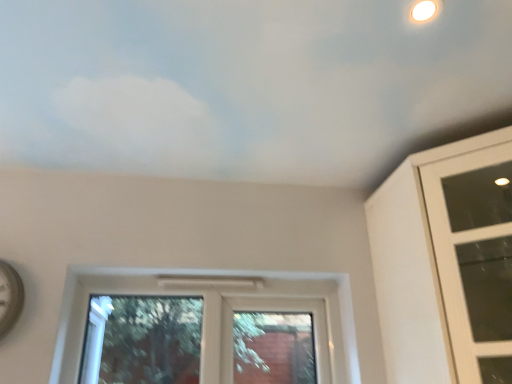
Question: From the image's perspective, is clear glass window at center, the 1th window viewed from the left, above white matte cloud at upper center?

Choices:
 (A) no
 (B) yes

Answer: (A)

Question: From the image's perspective, does clear glass window at center, marked as the 2th window in a right-to-left arrangement, appear lower than white matte cloud at upper center?

Choices:
 (A) yes
 (B) no

Answer: (A)

Question: Does clear glass window at center, marked as the 2th window in a right-to-left arrangement, appear on the right side of white matte cloud at upper center?

Choices:
 (A) no
 (B) yes

Answer: (A)

Question: Does clear glass window at center, marked as the 2th window in a right-to-left arrangement, have a smaller size compared to white matte cloud at upper center?

Choices:
 (A) yes
 (B) no

Answer: (A)

Question: Can we say clear glass window at center, the 1th window viewed from the left, lies outside white matte cloud at upper center?

Choices:
 (A) no
 (B) yes

Answer: (B)

Question: Considering the relative positions of clear glass window at center, the 1th window viewed from the left, and white matte cloud at upper center in the image provided, is clear glass window at center, the 1th window viewed from the left, to the left of white matte cloud at upper center from the viewer's perspective?

Choices:
 (A) yes
 (B) no

Answer: (A)

Question: Is white glass window at upper right, acting as the second window starting from the left, surrounding white matte cloud at upper center?

Choices:
 (A) no
 (B) yes

Answer: (A)

Question: Does white glass window at upper right, acting as the second window starting from the left, come behind white matte cloud at upper center?

Choices:
 (A) no
 (B) yes

Answer: (B)

Question: Can you confirm if white glass window at upper right, arranged as the first window when viewed from the right, is smaller than white matte cloud at upper center?

Choices:
 (A) no
 (B) yes

Answer: (A)

Question: Is white glass window at upper right, arranged as the first window when viewed from the right, not near white matte cloud at upper center?

Choices:
 (A) no
 (B) yes

Answer: (A)

Question: Does white glass window at upper right, arranged as the first window when viewed from the right, have a larger size compared to white matte cloud at upper center?

Choices:
 (A) yes
 (B) no

Answer: (A)

Question: Considering the relative positions of white glass window at upper right, arranged as the first window when viewed from the right, and white matte cloud at upper center in the image provided, is white glass window at upper right, arranged as the first window when viewed from the right, to the left of white matte cloud at upper center from the viewer's perspective?

Choices:
 (A) no
 (B) yes

Answer: (A)

Question: Is clear glass window at center, marked as the 2th window in a right-to-left arrangement, in contact with white glass window at upper right, arranged as the first window when viewed from the right?

Choices:
 (A) no
 (B) yes

Answer: (A)